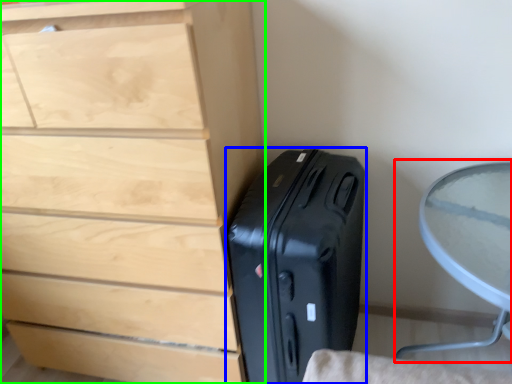
Question: Based on their relative distances, which object is nearer to round table (highlighted by a red box)? Choose from suitcase (highlighted by a blue box) and chest of drawers (highlighted by a green box).

Choices:
 (A) suitcase
 (B) chest of drawers

Answer: (A)